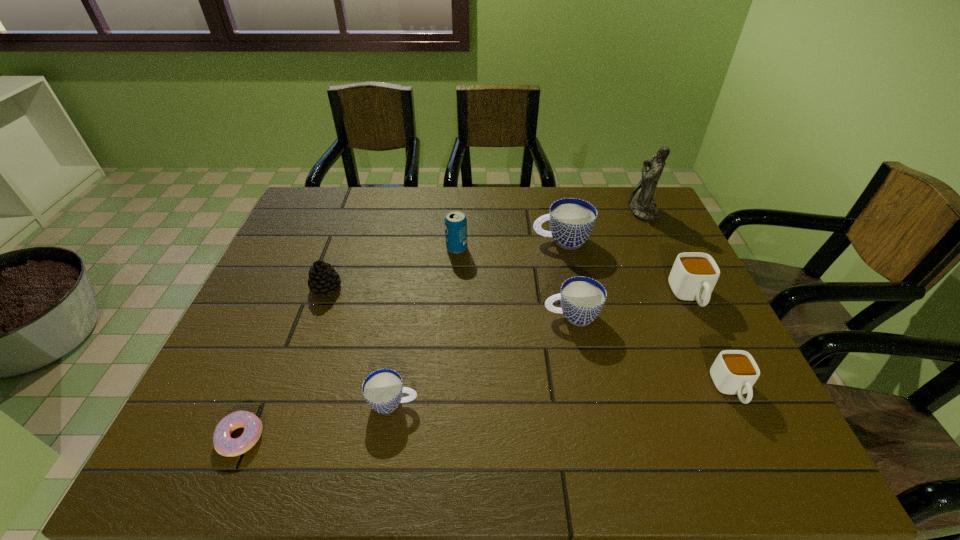
Locate an element on the screen. This screenshot has height=540, width=960. free space located on the side of the farthest cup with the handle is located at coordinates (512, 240).

Where is `vacant region located on the side with the handle of the bigger white cup`? vacant region located on the side with the handle of the bigger white cup is located at coordinates (723, 363).

Identify the location of vacant space situated 0.140m at the narrow end of the pinecone. (307, 341).

At what (x,y) coordinates should I click in order to perform the action: click on free space located 0.080m on the side of the second biggest blue cup with the handle. Please return your answer as a coordinate pair (x, y). The width and height of the screenshot is (960, 540). Looking at the image, I should click on click(x=512, y=316).

Identify the location of vacant area situated 0.190m on the side of the second biggest blue cup with the handle. (468, 316).

Find the location of `free region located on the side of the second biggest blue cup with the handle`. free region located on the side of the second biggest blue cup with the handle is located at coordinates (456, 316).

You are a GUI agent. You are given a task and a screenshot of the screen. Output one action in this format:
    pyautogui.click(x=<x>, y=<y>)
    Task: Click on the vacant space located 0.080m on the side with the handle of the smaller white cup
    
    Given the screenshot: What is the action you would take?
    pyautogui.click(x=759, y=449)

Find the location of a particular element. This screenshot has width=960, height=540. vacant area situated on the side of the nearest blue cup with the handle is located at coordinates (498, 403).

You are a GUI agent. You are given a task and a screenshot of the screen. Output one action in this format:
    pyautogui.click(x=<x>, y=<y>)
    Task: Click on the vacant space located on the back of the pink doughnut
    This screenshot has width=960, height=540.
    Given the screenshot: What is the action you would take?
    pyautogui.click(x=286, y=328)

I want to click on figurine present at the far edge, so coord(641,203).